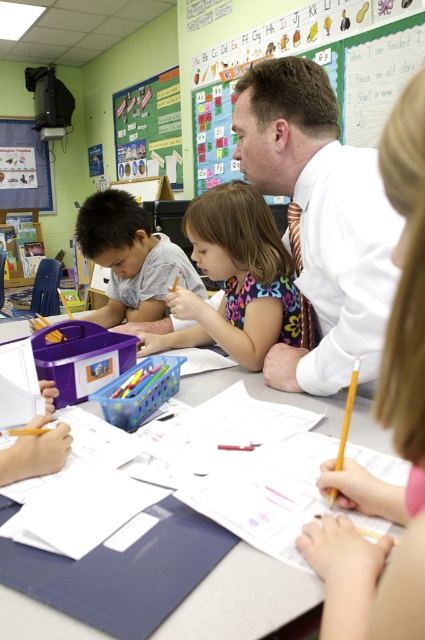
Question: Does white shirt at upper center have a lesser width compared to multicolored fabric dress at center?

Choices:
 (A) yes
 (B) no

Answer: (A)

Question: Which of the following is the farthest from the observer?

Choices:
 (A) tap(190, 307)
 (B) tap(258, 582)

Answer: (A)

Question: Based on their relative distances, which object is nearer to the matte gray shirt at left?

Choices:
 (A) white paper at center
 (B) white shirt at upper center
 (C) multicolored fabric dress at center

Answer: (C)

Question: Among these objects, which one is nearest to the camera?

Choices:
 (A) multicolored fabric dress at center
 (B) green paperboard at upper center
 (C) white shirt at upper center

Answer: (C)

Question: Can you confirm if green paperboard at upper center is bigger than matte gray shirt at left?

Choices:
 (A) yes
 (B) no

Answer: (A)

Question: Does white paper at center appear under multicolored fabric dress at center?

Choices:
 (A) no
 (B) yes

Answer: (B)